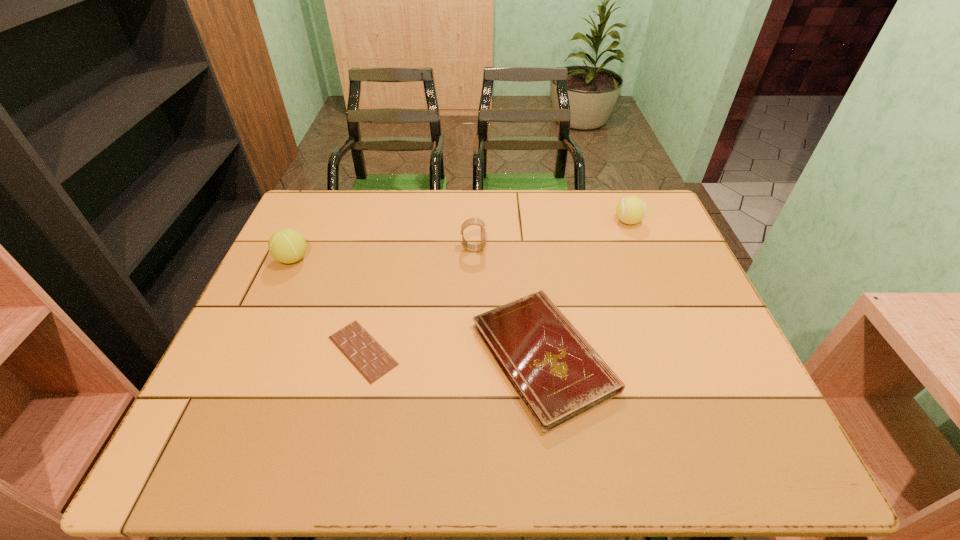
Locate an element on the screen. vacant space that is in between the farthest object and the second object from left to right is located at coordinates (495, 286).

The width and height of the screenshot is (960, 540). Find the location of `vacant point located between the leftmost object and the second object from left to right`. vacant point located between the leftmost object and the second object from left to right is located at coordinates (327, 305).

You are a GUI agent. You are given a task and a screenshot of the screen. Output one action in this format:
    pyautogui.click(x=<x>, y=<y>)
    Task: Click on the free area in between the left tennis ball and the notebook
    The height and width of the screenshot is (540, 960).
    Given the screenshot: What is the action you would take?
    pyautogui.click(x=418, y=308)

The height and width of the screenshot is (540, 960). I want to click on vacant space in between the fourth tallest object and the shortest object, so click(x=453, y=354).

Locate an element on the screen. object that stands as the third closest to the watch is located at coordinates (630, 210).

You are a GUI agent. You are given a task and a screenshot of the screen. Output one action in this format:
    pyautogui.click(x=<x>, y=<y>)
    Task: Click on the object that is the closest one to the watch
    Image resolution: width=960 pixels, height=540 pixels.
    Given the screenshot: What is the action you would take?
    pyautogui.click(x=556, y=373)

In order to click on free point that satisfies the following two spatial constraints: 1. on the face of the watch; 2. on the left side of the notebook in this screenshot , I will do `click(471, 356)`.

Image resolution: width=960 pixels, height=540 pixels. What are the coordinates of `free region that satisfies the following two spatial constraints: 1. on the face of the watch; 2. on the front side of the leftmost object` in the screenshot? It's located at (473, 259).

Locate an element on the screen. blank space that satisfies the following two spatial constraints: 1. on the face of the watch; 2. on the back side of the fourth tallest object is located at coordinates (471, 356).